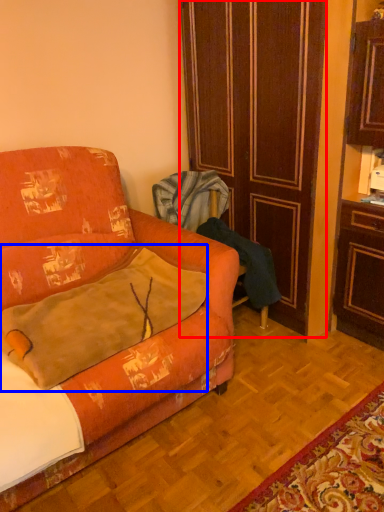
Question: Among these objects, which one is nearest to the camera, door (highlighted by a red box) or throw pillow (highlighted by a blue box)?

Choices:
 (A) door
 (B) throw pillow

Answer: (B)